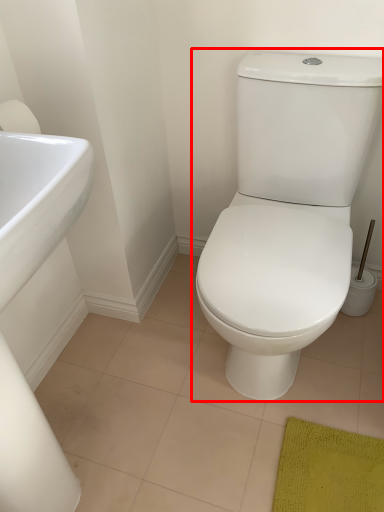
Question: From the image's perspective, where is toilet (annotated by the red box) located relative to sink?

Choices:
 (A) below
 (B) above

Answer: (B)